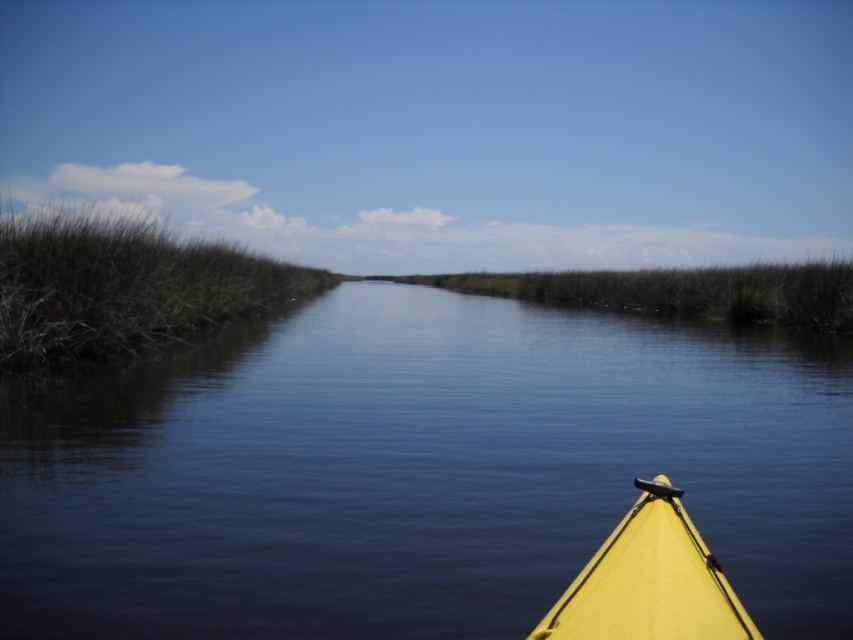
You are navigating a narrow waterway in a kayak and see the brown grass at left and the yellow matte kayak at lower right. Which object appears bigger in the scene?

The brown grass at left appears bigger in the scene compared to the yellow matte kayak at lower right.

You are in a kayak and want to paddle towards the smooth water at center. Which direction should you go relative to the brown grass at left?

The smooth water at center is located below the brown grass at left, so you should paddle downward from the brown grass at left to reach the smooth water at center.

You are kayaking on a calm waterway and want to check if you can reach the grasses on the left bank from your current position in the kayak. Based on the scene, can you determine if the brown grass at left is within reach from the yellow matte kayak at lower right?

The brown grass at left is above the yellow matte kayak at lower right, meaning it is positioned higher and likely further away from the kayak, making it unreachable from the current position.